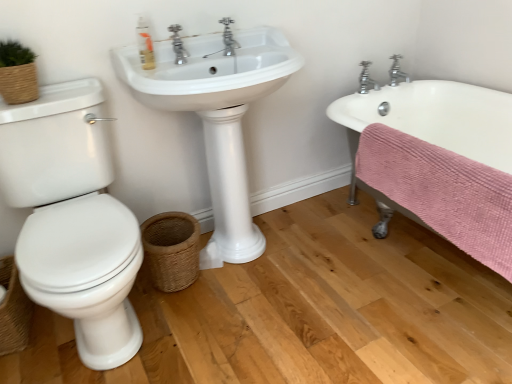
Find the location of a particular element. This screenshot has width=512, height=384. empty space that is ontop of pink textured towel at lower right (from a real-world perspective) is located at coordinates (446, 156).